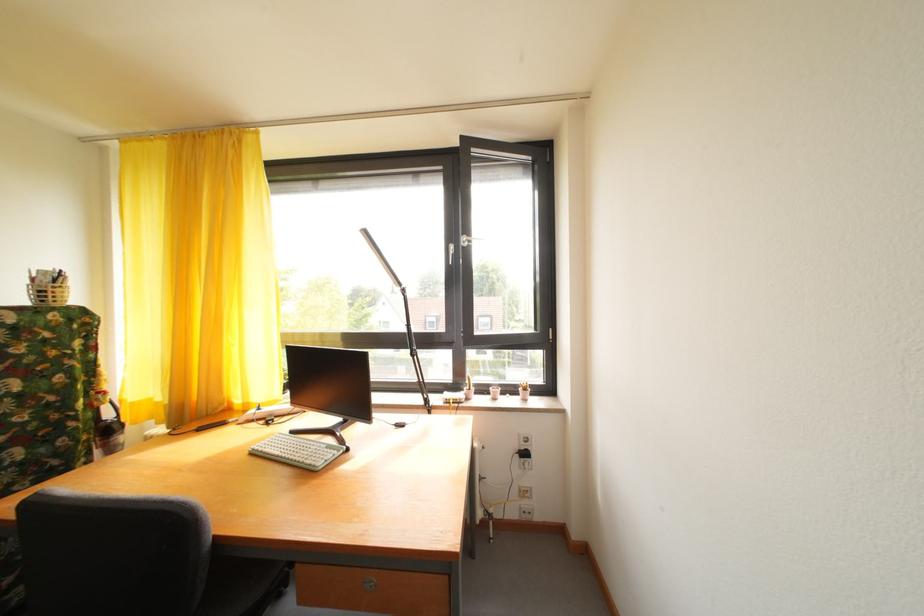
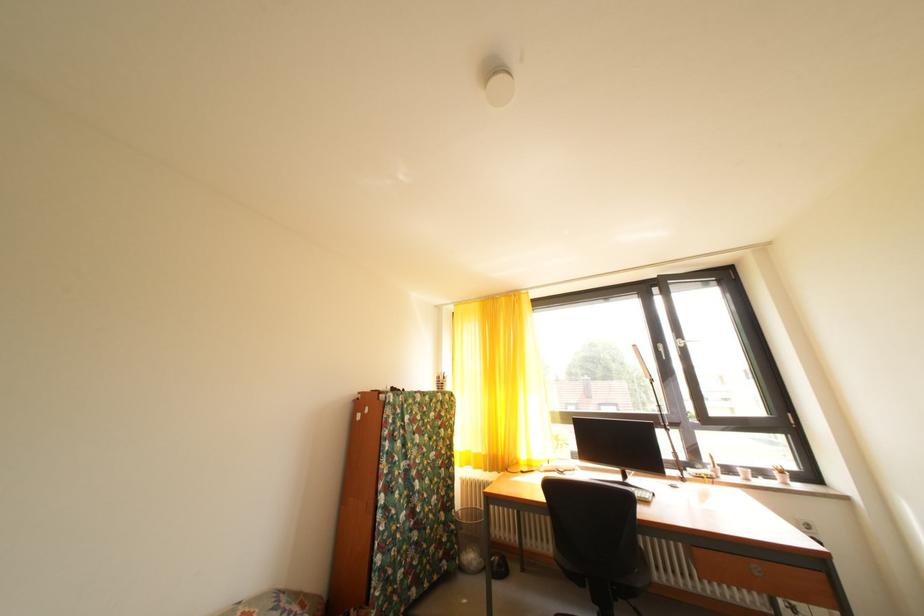
Where in the second image is the point corresponding to point (529, 395) from the first image?

(784, 479)